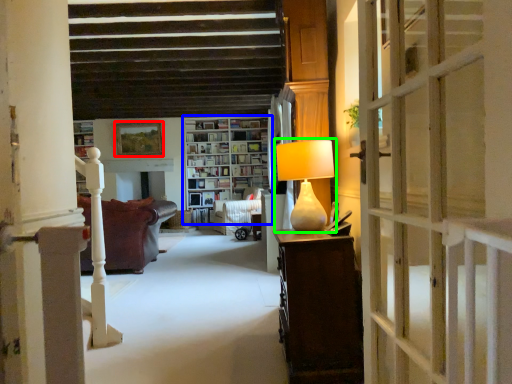
Question: Estimate the real-world distances between objects in this image. Which object is farther from picture frame (highlighted by a red box), bookcase (highlighted by a blue box) or table lamp (highlighted by a green box)?

Choices:
 (A) bookcase
 (B) table lamp

Answer: (B)